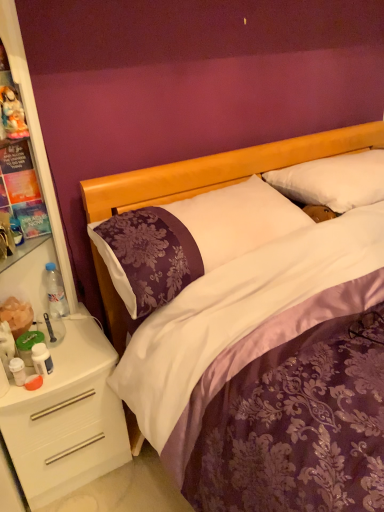
Question: From a real-world perspective, is matte plastic figurine at upper left positioned under clear plastic bottle at left based on gravity?

Choices:
 (A) no
 (B) yes

Answer: (A)

Question: Is clear plastic bottle at left a part of matte plastic figurine at upper left?

Choices:
 (A) no
 (B) yes

Answer: (A)

Question: Does matte plastic figurine at upper left come behind clear plastic bottle at left?

Choices:
 (A) no
 (B) yes

Answer: (A)

Question: Is matte plastic figurine at upper left to the right of clear plastic bottle at left from the viewer's perspective?

Choices:
 (A) yes
 (B) no

Answer: (B)

Question: From a real-world perspective, is matte plastic figurine at upper left located higher than clear plastic bottle at left?

Choices:
 (A) yes
 (B) no

Answer: (A)

Question: Can you confirm if matte plastic figurine at upper left is wider than clear plastic bottle at left?

Choices:
 (A) no
 (B) yes

Answer: (A)

Question: Can purple satin pillow at center, marked as the 2th pillow in a right-to-left arrangement, be found inside matte plastic figurine at upper left?

Choices:
 (A) no
 (B) yes

Answer: (A)

Question: Is matte plastic figurine at upper left to the right of purple satin pillow at center, positioned as the 1th pillow in left-to-right order, from the viewer's perspective?

Choices:
 (A) yes
 (B) no

Answer: (B)

Question: Can you confirm if matte plastic figurine at upper left is thinner than purple satin pillow at center, positioned as the 1th pillow in left-to-right order?

Choices:
 (A) no
 (B) yes

Answer: (B)

Question: Considering the relative sizes of matte plastic figurine at upper left and purple satin pillow at center, marked as the 2th pillow in a right-to-left arrangement, in the image provided, is matte plastic figurine at upper left taller than purple satin pillow at center, marked as the 2th pillow in a right-to-left arrangement,?

Choices:
 (A) yes
 (B) no

Answer: (B)

Question: From a real-world perspective, is matte plastic figurine at upper left below purple satin pillow at center, marked as the 2th pillow in a right-to-left arrangement?

Choices:
 (A) no
 (B) yes

Answer: (A)

Question: Does matte plastic figurine at upper left have a lesser height compared to purple satin pillow at center, positioned as the 1th pillow in left-to-right order?

Choices:
 (A) yes
 (B) no

Answer: (A)

Question: Could you tell me if white plastic dresser at left is facing matte plastic figurine at upper left?

Choices:
 (A) no
 (B) yes

Answer: (B)